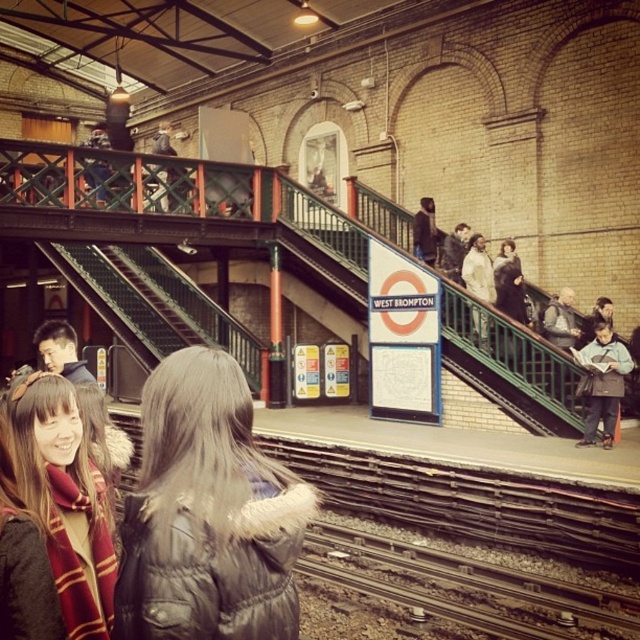
Looking at this image, can you confirm if black leather jacket at center is positioned above red plaid scarf at lower left?

No, black leather jacket at center is not above red plaid scarf at lower left.

Is black leather jacket at center closer to the viewer compared to red plaid scarf at lower left?

Yes, it is.

Is point (118, 596) farther from camera compared to point (4, 403)?

No.

Locate an element on the screen. This screenshot has width=640, height=640. black leather jacket at center is located at coordinates (208, 513).

Which is more to the right, black leather jacket at center or light blue fabric jacket at right?

light blue fabric jacket at right is more to the right.

Describe the element at coordinates (208, 513) in the screenshot. The height and width of the screenshot is (640, 640). I see `black leather jacket at center` at that location.

Locate an element on the screen. The width and height of the screenshot is (640, 640). black leather jacket at center is located at coordinates (208, 513).

Who is positioned more to the left, red plaid scarf at lower left or light blue fabric jacket at right?

red plaid scarf at lower left is more to the left.

Find the location of a particular element. The image size is (640, 640). red plaid scarf at lower left is located at coordinates (65, 499).

Image resolution: width=640 pixels, height=640 pixels. In order to click on red plaid scarf at lower left in this screenshot , I will do pos(65,499).